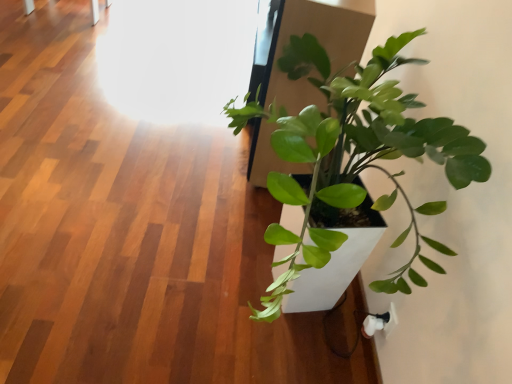
Question: Should I look upward or downward to see green matte plant at right?

Choices:
 (A) up
 (B) down

Answer: (B)